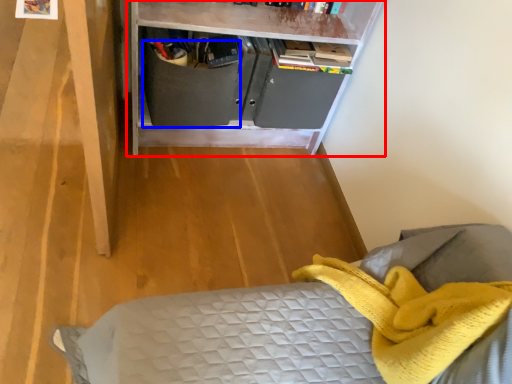
Question: Which point is further to the camera, shelf (highlighted by a red box) or drawer (highlighted by a blue box)?

Choices:
 (A) shelf
 (B) drawer

Answer: (B)